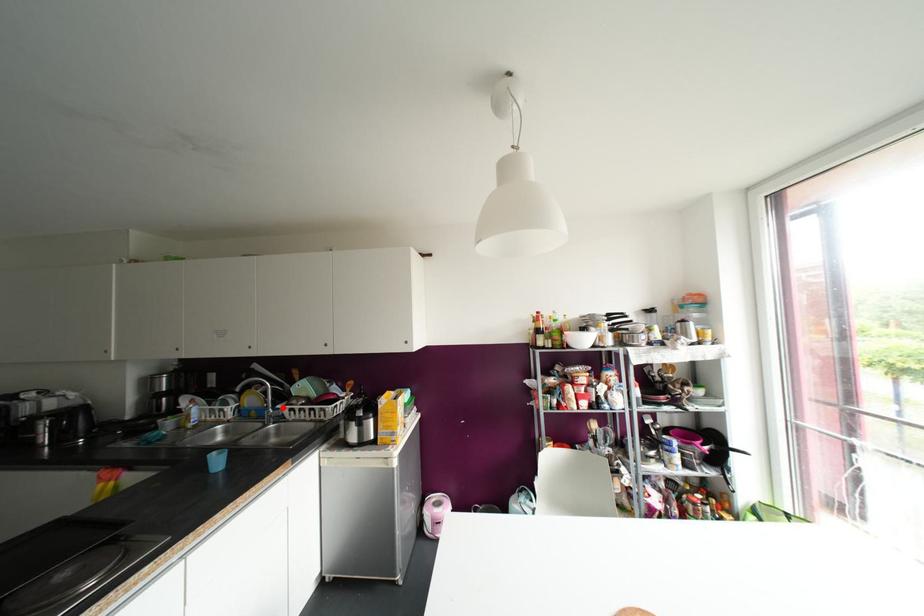
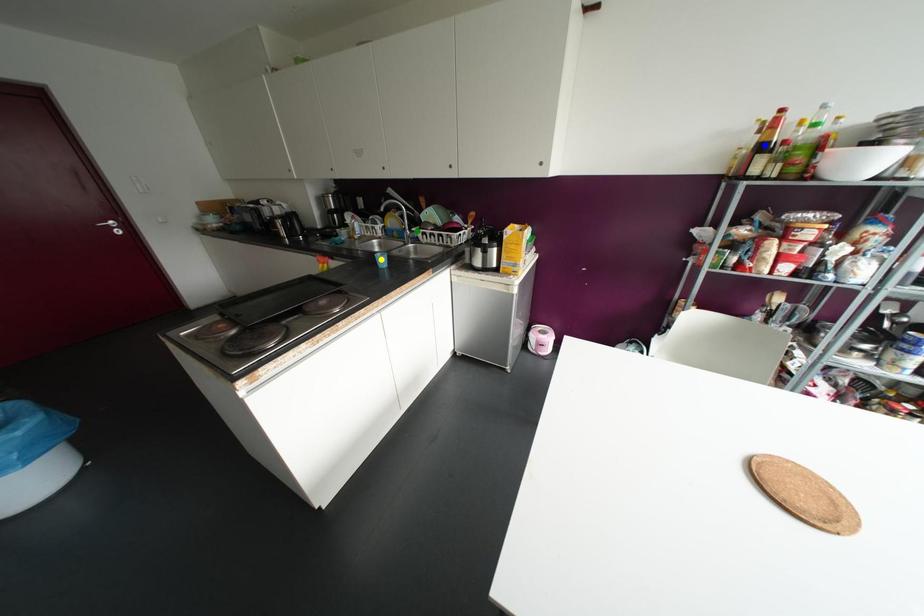
Question: I am providing you with two images of the same scene from different viewpoints. A red point is marked on the first image. You are given multiple points on the second image. Which point in image 2 represents the same 3d spot as the red point in image 1?

Choices:
 (A) green point
 (B) yellow point
 (C) blue point

Answer: (A)